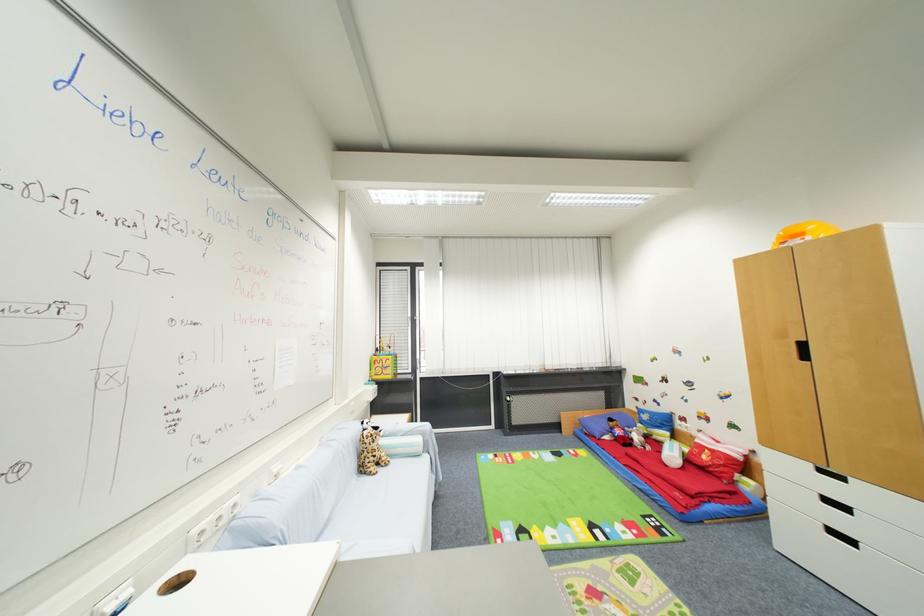
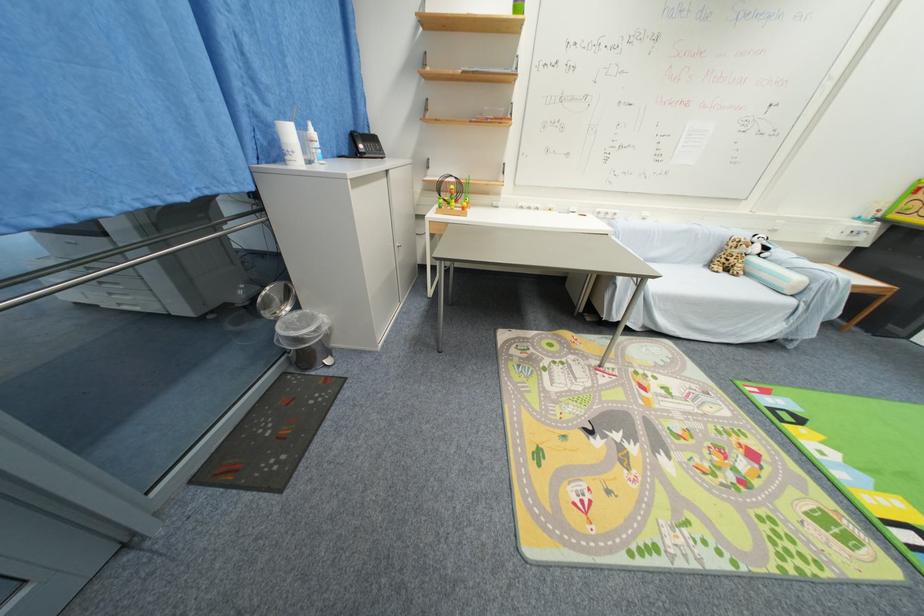
Where in the second image is the point corresponding to the point at 385,472 from the first image?

(730, 276)